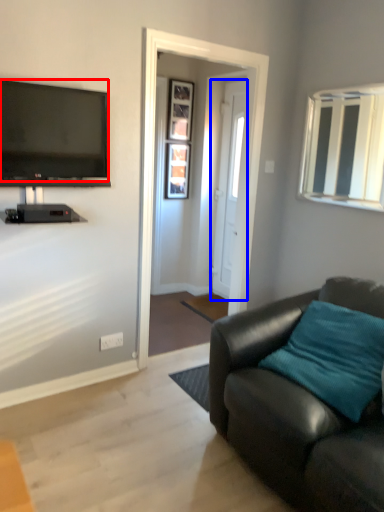
Question: Which object appears closest to the camera in this image, television (highlighted by a red box) or door (highlighted by a blue box)?

Choices:
 (A) television
 (B) door

Answer: (A)